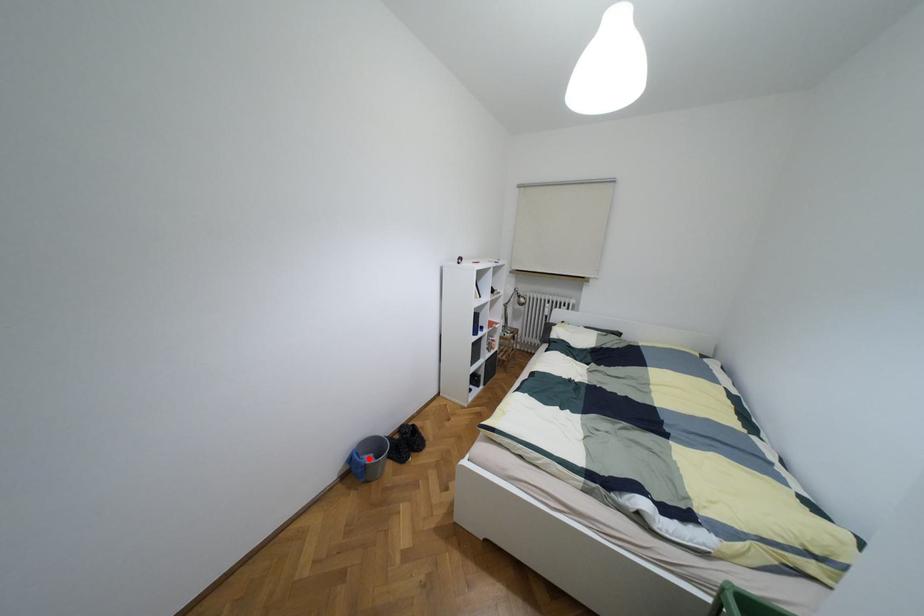
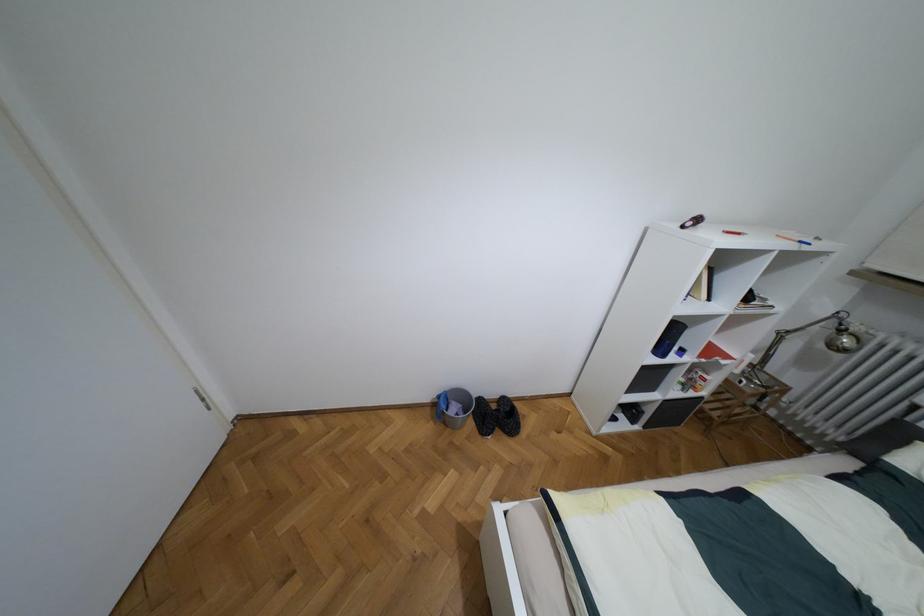
The point at the highlighted location is marked in the first image. Where is the corresponding point in the second image?

(453, 408)